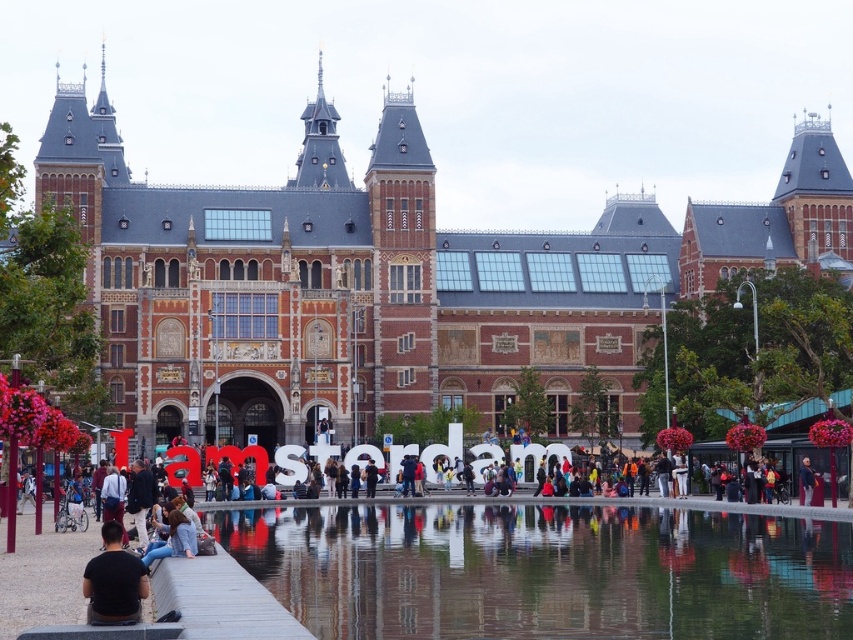
Based on the photo, who is shorter, black matte shirt at lower left or dark blue fabric pants at center?

dark blue fabric pants at center

Can you confirm if black matte shirt at lower left is taller than dark blue fabric pants at center?

Indeed, black matte shirt at lower left has a greater height compared to dark blue fabric pants at center.

Does point (119, 618) come farther from viewer compared to point (804, 496)?

No, it is not.

At what (x,y) coordinates should I click in order to perform the action: click on black matte shirt at lower left. Please return your answer as a coordinate pair (x, y). Image resolution: width=853 pixels, height=640 pixels. Looking at the image, I should click on (114, 580).

Does reflective glass water at center appear under black matte shirt at lower left?

Correct, reflective glass water at center is located below black matte shirt at lower left.

Between reflective glass water at center and black matte shirt at lower left, which one has less height?

With less height is reflective glass water at center.

Who is more distant from viewer, (347,522) or (140,573)?

The point (347,522) is behind.

Locate an element on the screen. The height and width of the screenshot is (640, 853). reflective glass water at center is located at coordinates (544, 570).

Does reflective glass water at center have a lesser height compared to dark blue fabric pants at center?

Indeed, reflective glass water at center has a lesser height compared to dark blue fabric pants at center.

You are a GUI agent. You are given a task and a screenshot of the screen. Output one action in this format:
    pyautogui.click(x=<x>, y=<y>)
    Task: Click on the reflective glass water at center
    The width and height of the screenshot is (853, 640).
    Given the screenshot: What is the action you would take?
    pyautogui.click(x=544, y=570)

Describe the element at coordinates (544, 570) in the screenshot. The width and height of the screenshot is (853, 640). I see `reflective glass water at center` at that location.

The width and height of the screenshot is (853, 640). I want to click on reflective glass water at center, so click(544, 570).